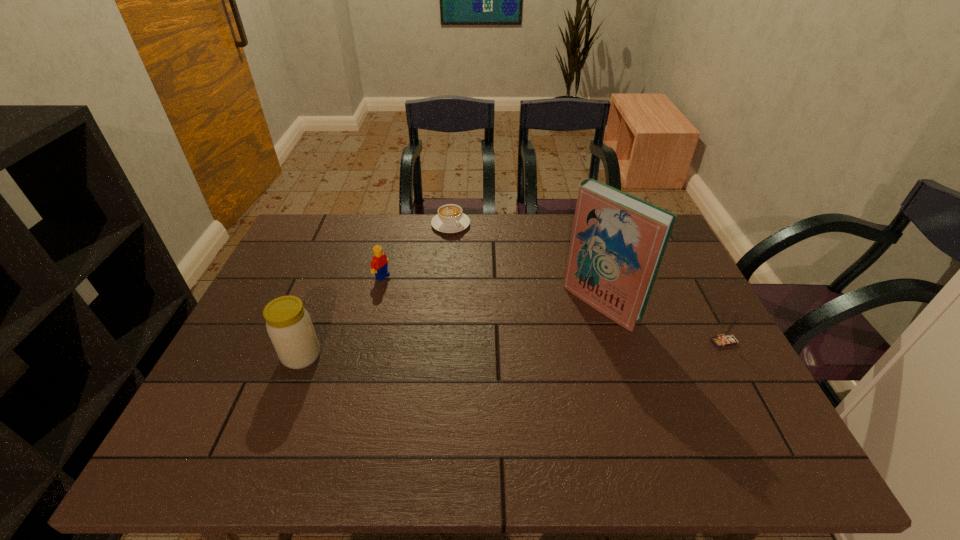
You are a GUI agent. You are given a task and a screenshot of the screen. Output one action in this format:
    pyautogui.click(x=<x>, y=<y>)
    Task: Click on the object at the left edge
    Image resolution: width=960 pixels, height=540 pixels.
    Given the screenshot: What is the action you would take?
    pyautogui.click(x=289, y=326)

The image size is (960, 540). I want to click on object present at the right edge, so (727, 340).

Locate an element on the screen. Image resolution: width=960 pixels, height=540 pixels. vacant space at the far edge of the desktop is located at coordinates (375, 233).

Identify the location of vacant area at the near edge of the desktop. (533, 422).

In the image, there is a desktop. Find the location of `vacant space at the left edge`. vacant space at the left edge is located at coordinates click(293, 291).

You are a GUI agent. You are given a task and a screenshot of the screen. Output one action in this format:
    pyautogui.click(x=<x>, y=<y>)
    Task: Click on the vacant space at the right edge of the desktop
    
    Given the screenshot: What is the action you would take?
    pyautogui.click(x=691, y=285)

Identify the location of free space at the near right corner. (698, 400).

Find the location of `free area in between the second tallest object and the shortest object`. free area in between the second tallest object and the shortest object is located at coordinates (376, 290).

Identify the location of free spot between the fourth object from right to left and the cappuccino. Image resolution: width=960 pixels, height=540 pixels. (417, 251).

Find the location of a particular element. The width and height of the screenshot is (960, 540). empty space that is in between the jar and the second object from left to right is located at coordinates (342, 316).